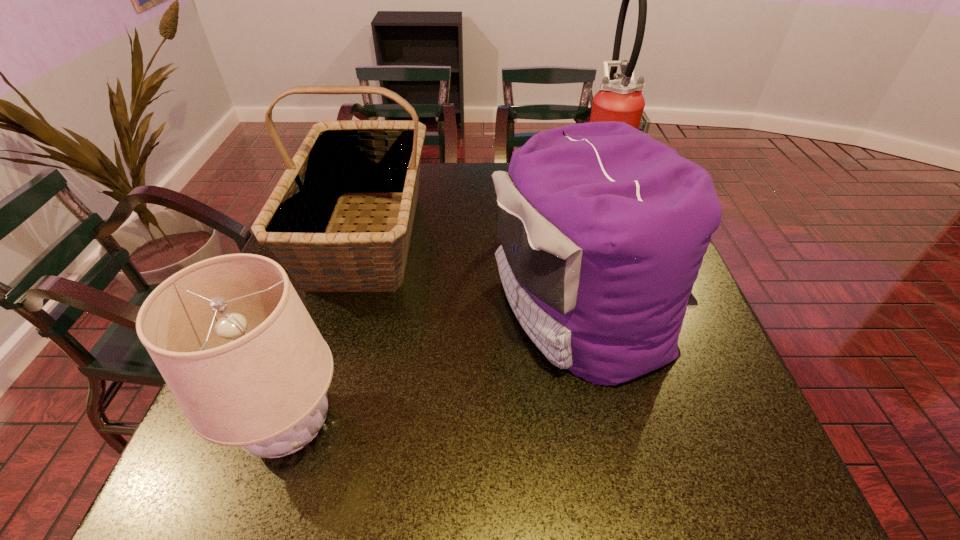
Locate an element on the screen. This screenshot has width=960, height=540. vacant point located between the lampshade and the tallest object is located at coordinates (444, 309).

Image resolution: width=960 pixels, height=540 pixels. In order to click on unoccupied area between the fire extinguisher and the lampshade in this screenshot , I will do `click(444, 309)`.

Identify the location of vacant space that is in between the lampshade and the tallest object. (444, 309).

This screenshot has height=540, width=960. I want to click on object that is the third closest to the basket, so coord(621,100).

Select which object appears as the third closest to the basket. Please provide its 2D coordinates. Your answer should be formatted as a tuple, i.e. [(x, y)], where the tuple contains the x and y coordinates of a point satisfying the conditions above.

[(621, 100)]

Identify the location of vacant area in the image that satisfies the following two spatial constraints: 1. at the nozzle of the fire extinguisher; 2. by the handle of the basket. This screenshot has height=540, width=960. (615, 235).